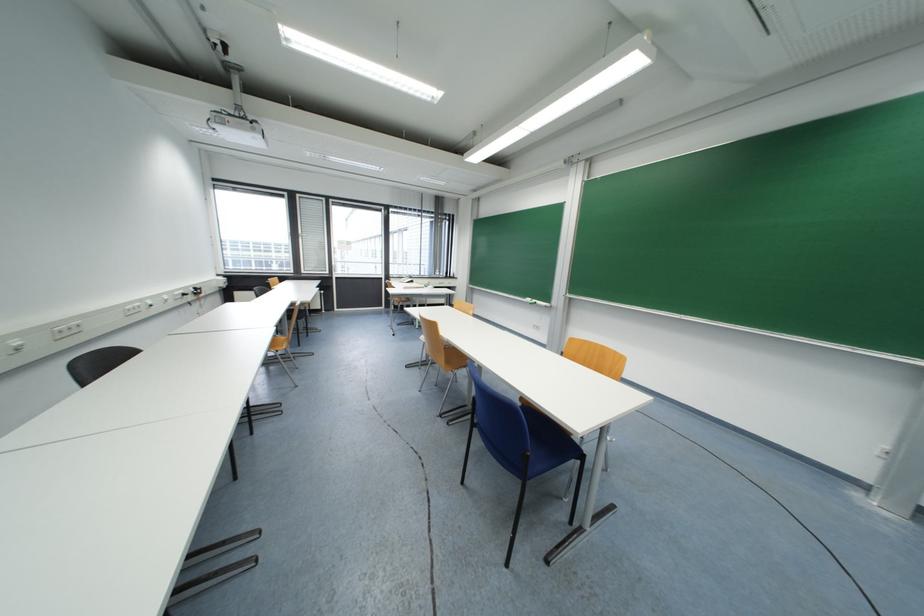
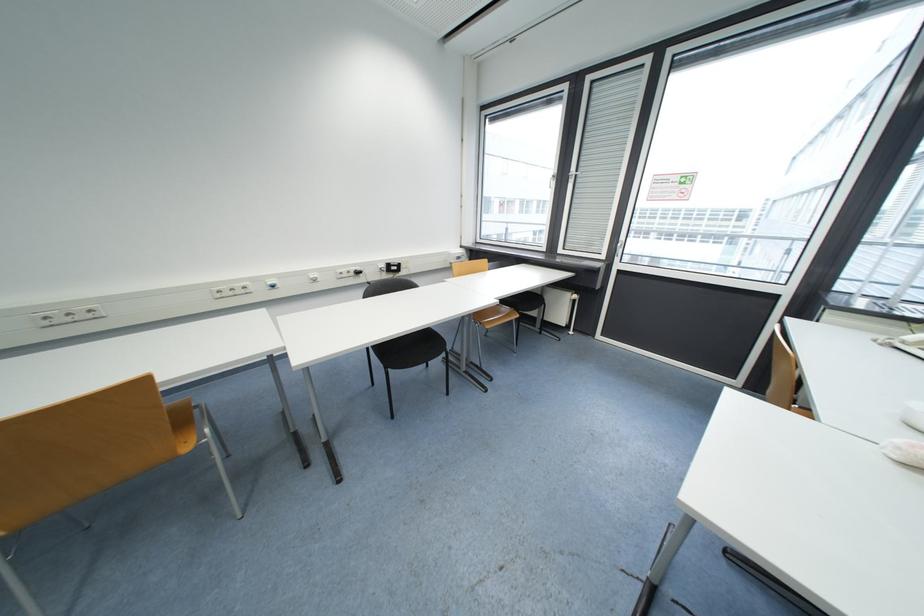
Find the pixel in the second image that matches the point at 302,197 in the first image.

(593, 81)